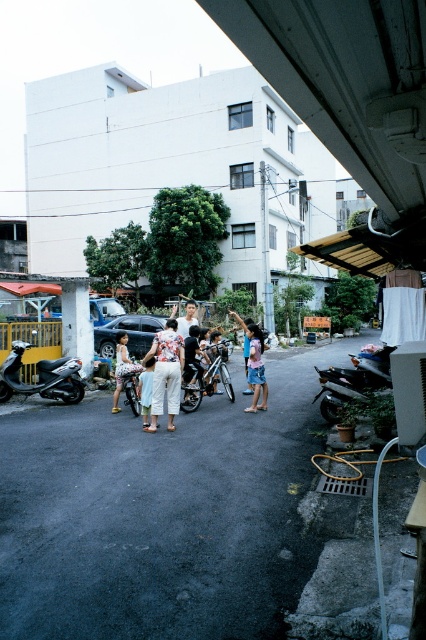
Does metallic silver motorcycle at center have a lesser width compared to light blue denim shorts at center?

Incorrect, metallic silver motorcycle at center's width is not less than light blue denim shorts at center's.

Based on the photo, is metallic silver motorcycle at center below light blue denim shorts at center?

Yes, metallic silver motorcycle at center is below light blue denim shorts at center.

Is point (232, 396) farther from camera compared to point (261, 378)?

That is True.

Locate an element on the screen. This screenshot has height=640, width=426. metallic silver motorcycle at center is located at coordinates (207, 378).

Is shiny black motorcycle at lower right smaller than silver metallic scooter at left?

No.

Can you confirm if shiny black motorcycle at lower right is wider than silver metallic scooter at left?

Incorrect, shiny black motorcycle at lower right's width does not surpass silver metallic scooter at left's.

Does point (348, 371) come behind point (69, 365)?

No, it is not.

Where is `shiny black motorcycle at lower right`? The image size is (426, 640). shiny black motorcycle at lower right is located at coordinates (353, 381).

Which is behind, point (189, 333) or point (143, 419)?

The point (189, 333) is more distant.

Describe the element at coordinates (192, 356) in the screenshot. This screenshot has height=640, width=426. I see `light brown leather jacket at center` at that location.

This screenshot has height=640, width=426. I want to click on light brown leather jacket at center, so click(192, 356).